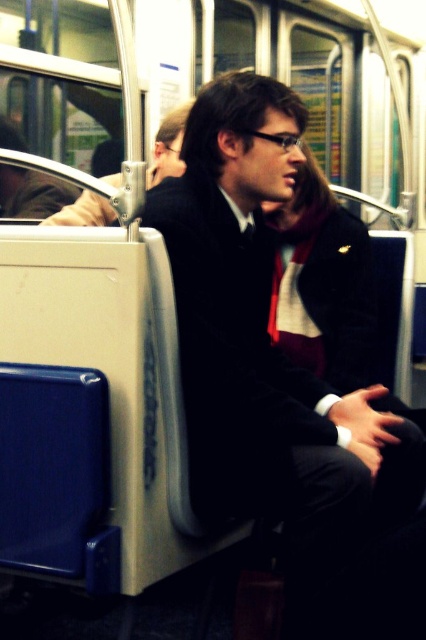
Between matte black jacket at center and matte black jacket at upper left, which one is positioned higher?

Positioned higher is matte black jacket at upper left.

Is matte black jacket at center bigger than matte black jacket at upper left?

Correct, matte black jacket at center is larger in size than matte black jacket at upper left.

Image resolution: width=426 pixels, height=640 pixels. Describe the element at coordinates (267, 355) in the screenshot. I see `matte black jacket at center` at that location.

You are a GUI agent. You are given a task and a screenshot of the screen. Output one action in this format:
    pyautogui.click(x=<x>, y=<y>)
    Task: Click on the matte black jacket at center
    The width and height of the screenshot is (426, 640).
    Given the screenshot: What is the action you would take?
    pyautogui.click(x=267, y=355)